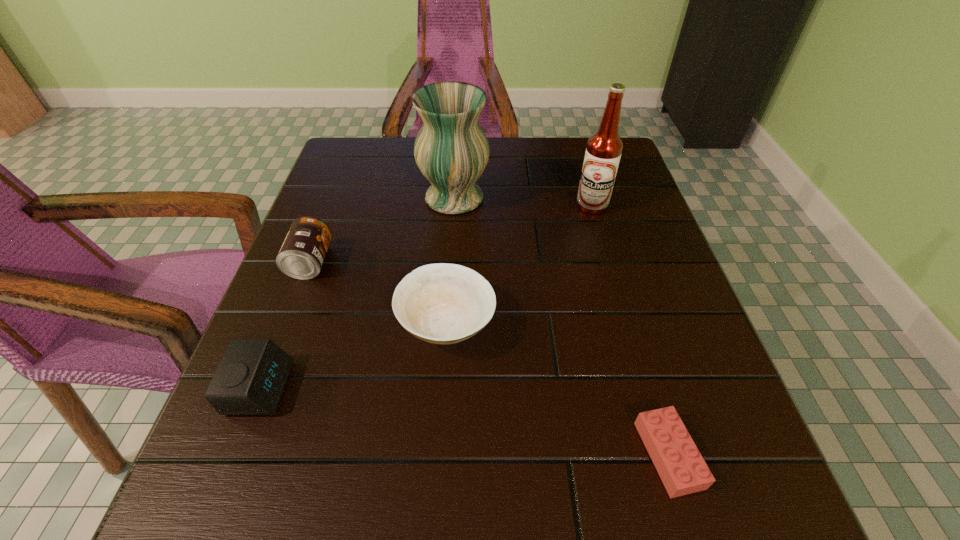
Find the location of `alcohol`. alcohol is located at coordinates (604, 148).

Where is `vase`? The image size is (960, 540). vase is located at coordinates coord(451,150).

You are a GUI agent. You are given a task and a screenshot of the screen. Output one action in this format:
    pyautogui.click(x=<x>, y=<y>)
    Task: Click on the third farthest object
    The height and width of the screenshot is (540, 960).
    Given the screenshot: What is the action you would take?
    pyautogui.click(x=301, y=256)

Find the location of a particular element. This screenshot has width=960, height=540. bowl is located at coordinates (441, 303).

Locate an element on the screen. alarm clock is located at coordinates (250, 380).

This screenshot has width=960, height=540. I want to click on Lego, so click(x=682, y=469).

I want to click on free space located on the label side of the alcohol, so click(x=623, y=314).

Image resolution: width=960 pixels, height=540 pixels. I want to click on vacant space located 0.370m on the right of the vase, so click(644, 198).

Image resolution: width=960 pixels, height=540 pixels. Identify the location of blank space located 0.300m on the front label of the can. (478, 262).

This screenshot has width=960, height=540. In order to click on free space located 0.120m on the right of the bowl in this screenshot , I will do `click(563, 324)`.